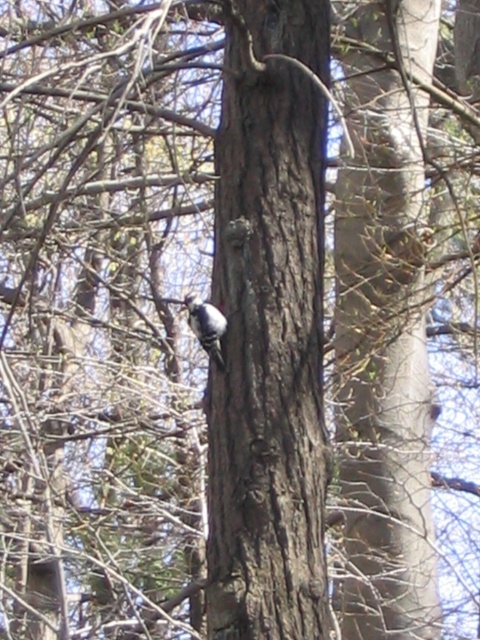
Does smooth brown bark at center appear over white speckled woodpecker at center?

Correct, smooth brown bark at center is located above white speckled woodpecker at center.

This screenshot has width=480, height=640. Describe the element at coordinates (268, 328) in the screenshot. I see `smooth brown bark at center` at that location.

Locate an element on the screen. This screenshot has height=640, width=480. smooth brown bark at center is located at coordinates (268, 328).